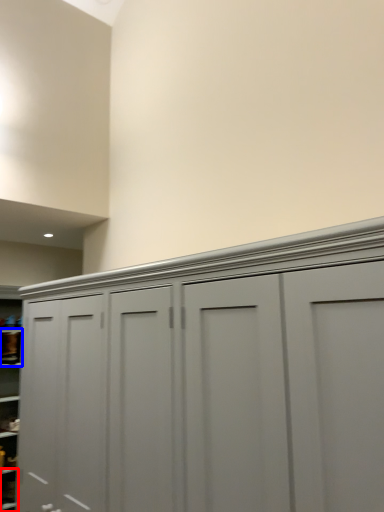
Question: Which object is closer to the camera taking this photo, cabinet (highlighted by a red box) or cabinet (highlighted by a blue box)?

Choices:
 (A) cabinet
 (B) cabinet

Answer: (A)